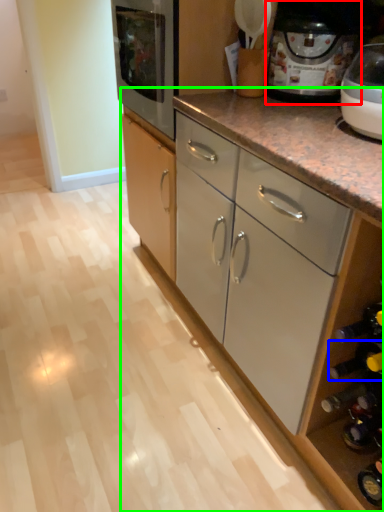
Question: Estimate the real-world distances between objects in this image. Which object is closer to home appliance (highlighted by a red box), wine bottle (highlighted by a blue box) or cabinetry (highlighted by a green box)?

Choices:
 (A) wine bottle
 (B) cabinetry

Answer: (B)